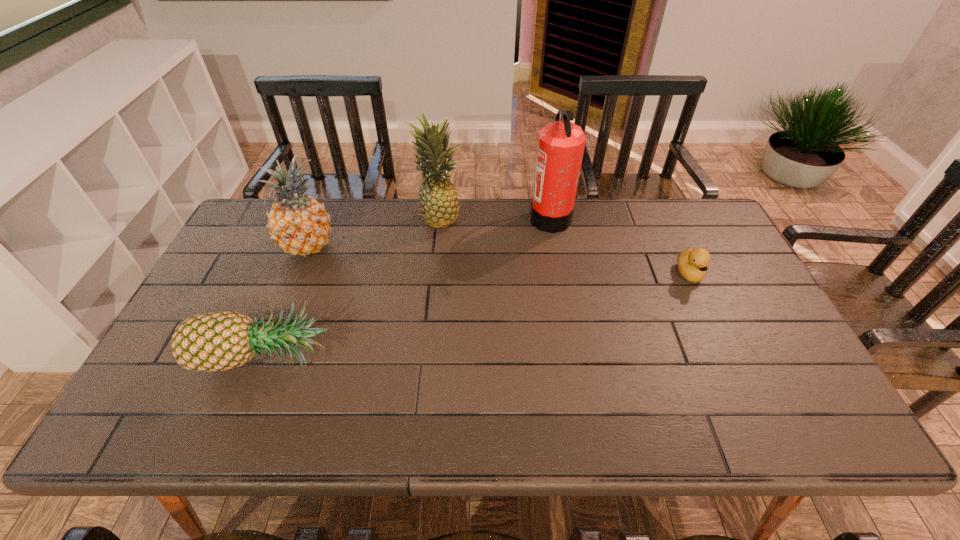
In the image, there is a desktop. Identify the location of vacant space at the right edge. (726, 265).

Where is `blank space at the far right corner of the desktop`? Image resolution: width=960 pixels, height=540 pixels. blank space at the far right corner of the desktop is located at coordinates (666, 198).

At what (x,y) coordinates should I click in order to perform the action: click on vacant space at the near right corner. Please return your answer as a coordinate pair (x, y). This screenshot has width=960, height=540. Looking at the image, I should click on (766, 425).

Identify the location of empty space that is in between the shortest object and the second shortest object. (477, 314).

Locate an element on the screen. empty location between the tallest pineapple and the third shortest object is located at coordinates (373, 232).

The height and width of the screenshot is (540, 960). What are the coordinates of `vacant space that is in between the shortest object and the third object from left to right` in the screenshot? It's located at (564, 246).

This screenshot has width=960, height=540. In order to click on empty location between the fire extinguisher and the second tallest pineapple in this screenshot , I will do `click(429, 231)`.

Locate an element on the screen. This screenshot has width=960, height=540. vacant space in between the tallest pineapple and the fire extinguisher is located at coordinates (494, 217).

Locate an element on the screen. The width and height of the screenshot is (960, 540). free space that is in between the third tallest object and the nearest pineapple is located at coordinates (286, 300).

Where is `vacant area that lies between the second tallest pineapple and the third object from right to left`? vacant area that lies between the second tallest pineapple and the third object from right to left is located at coordinates (373, 232).